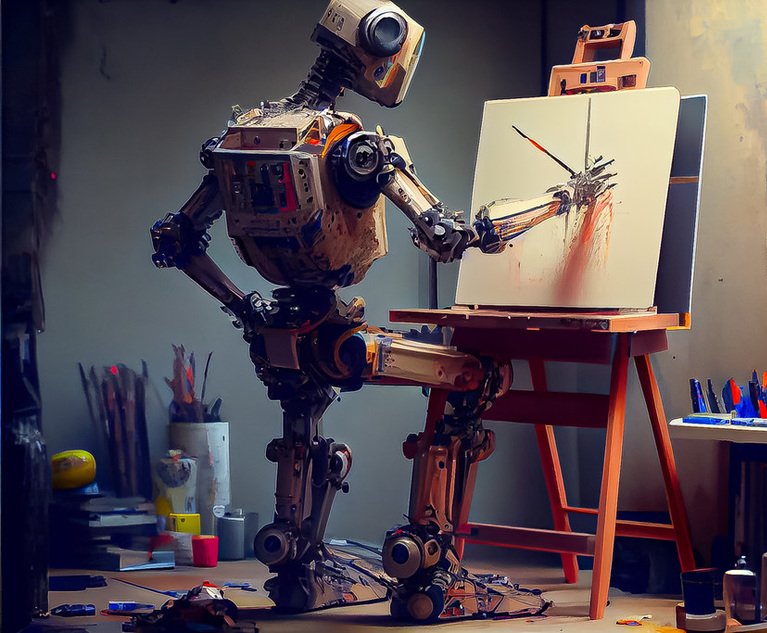
This screenshot has height=633, width=767. In order to click on light-coloured wall in this screenshot , I will do `click(723, 49)`.